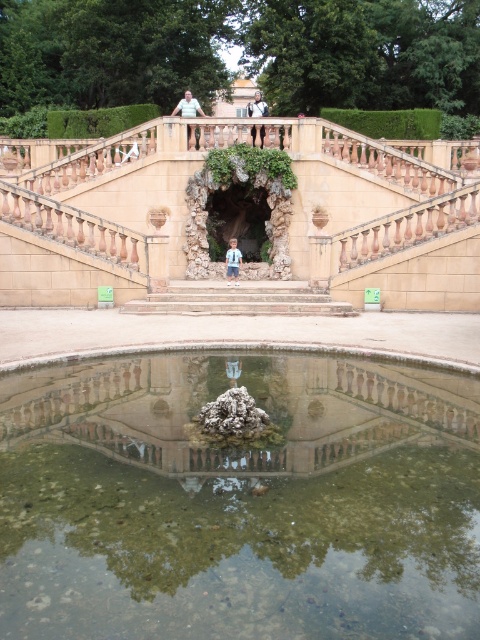
Is clear glass water at center thinner than light blue denim shorts at center?

Incorrect, clear glass water at center's width is not less than light blue denim shorts at center's.

Between point (7, 464) and point (237, 257), which one is positioned in front?

Point (7, 464)

This screenshot has height=640, width=480. Identify the location of clear glass water at center. (239, 500).

Which of these two, light blue denim shorts at center or matte blue shirt at upper center, stands shorter?

With less height is light blue denim shorts at center.

In the scene shown: Which is above, light blue denim shorts at center or matte blue shirt at upper center?

matte blue shirt at upper center is higher up.

The height and width of the screenshot is (640, 480). What do you see at coordinates (232, 260) in the screenshot?
I see `light blue denim shorts at center` at bounding box center [232, 260].

Locate an element on the screen. light blue denim shorts at center is located at coordinates (232, 260).

Which is more to the right, light blue denim shorts at center or light blue denim shorts at upper center?

light blue denim shorts at upper center

Does light blue denim shorts at center come in front of light blue denim shorts at upper center?

That is True.

This screenshot has width=480, height=640. What do you see at coordinates (232, 260) in the screenshot?
I see `light blue denim shorts at center` at bounding box center [232, 260].

This screenshot has height=640, width=480. I want to click on light blue denim shorts at center, so click(x=232, y=260).